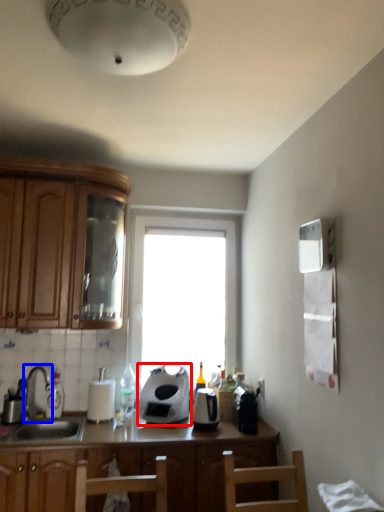
Question: Which point is closer to the camera, kitchen appliance (highlighted by a red box) or tap (highlighted by a blue box)?

Choices:
 (A) kitchen appliance
 (B) tap

Answer: (B)